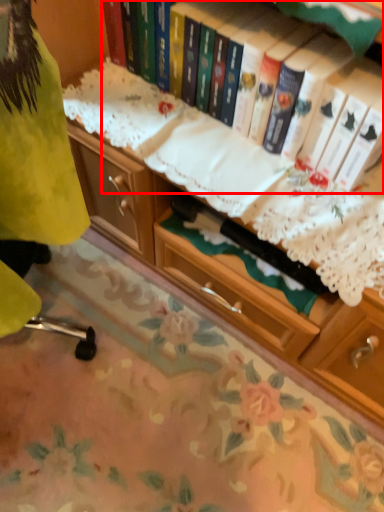
Question: From the image, what is the correct spatial relationship of book (annotated by the red box) in relation to tablecloth?

Choices:
 (A) left
 (B) right

Answer: (B)